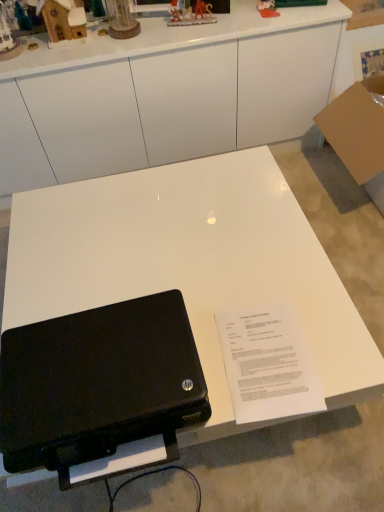
This screenshot has height=512, width=384. Find the location of `vacant space to the right of matte wooden clock at upper center, the third toy when ordered from left to right`. vacant space to the right of matte wooden clock at upper center, the third toy when ordered from left to right is located at coordinates (165, 26).